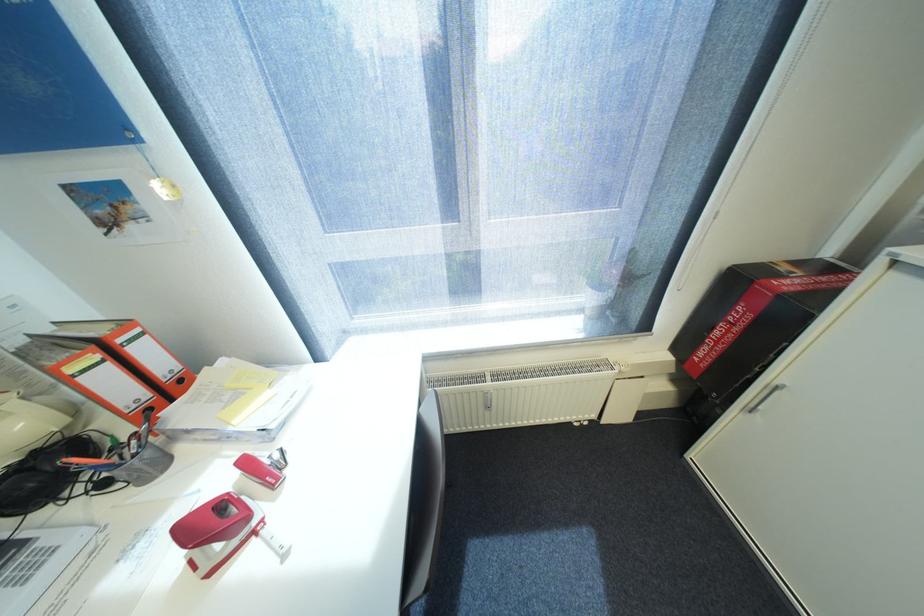
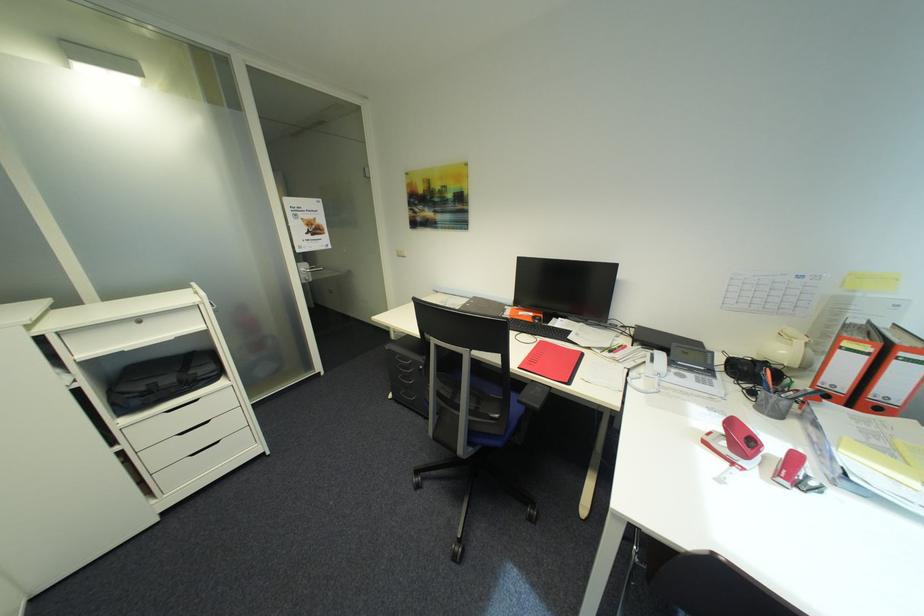
In the second image, find the point that corresponds to (116,367) in the first image.

(872, 359)